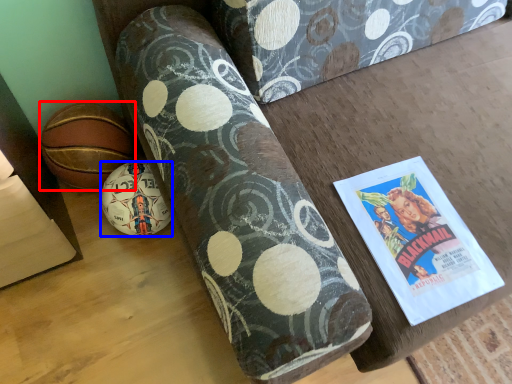
Question: Which of the following is the farthest to the observer, ball (highlighted by a red box) or ball (highlighted by a blue box)?

Choices:
 (A) ball
 (B) ball

Answer: (A)